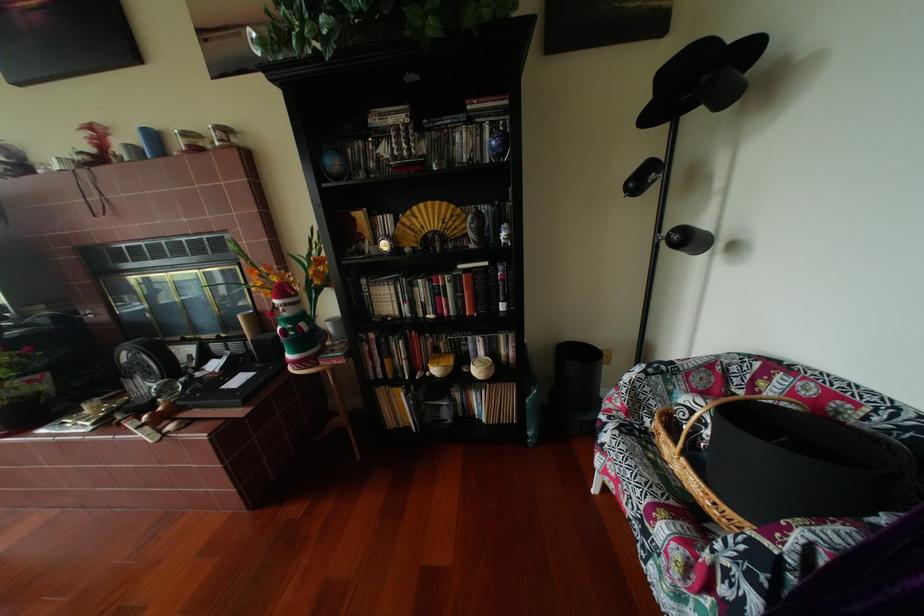
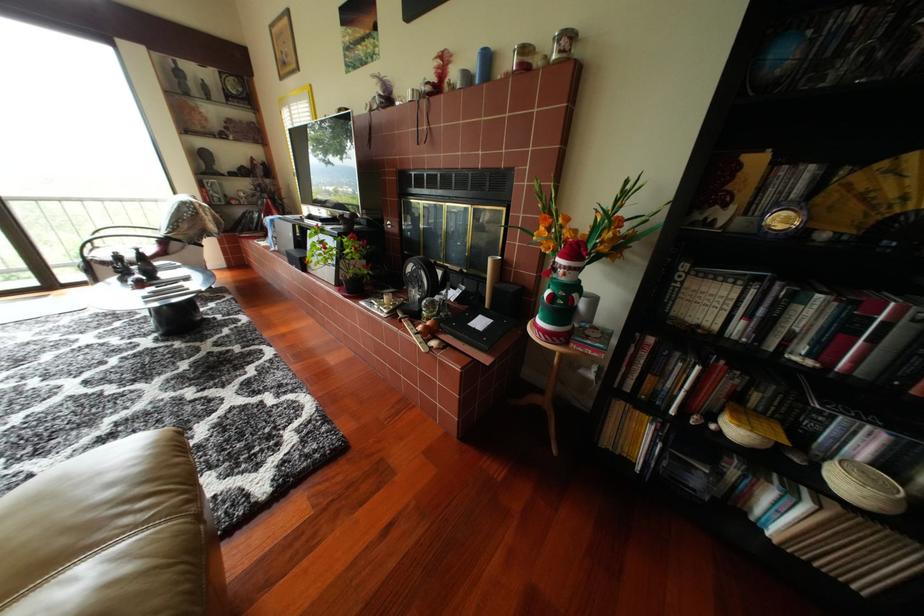
Question: The images are taken continuously from a first-person perspective. In which direction is your viewpoint rotating?

Choices:
 (A) Left
 (B) Right
 (C) Up
 (D) Down

Answer: (A)